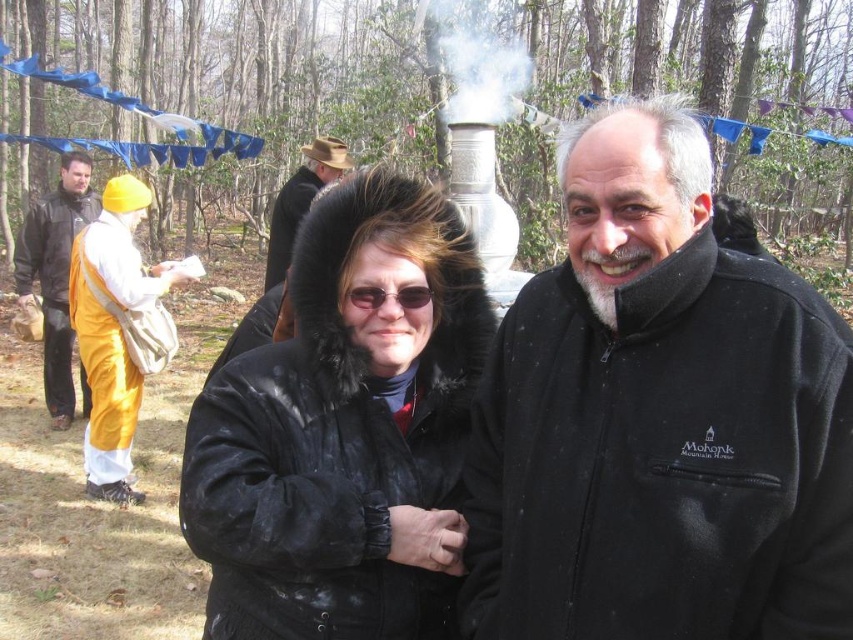
Question: Which of the following is the farthest from the observer?

Choices:
 (A) sunglasses at center
 (B) black fleece jacket at center
 (C) matte yellow robe at left

Answer: (C)

Question: Can you confirm if black fleece jacket at center is positioned above brown felt hat at upper center?

Choices:
 (A) yes
 (B) no

Answer: (B)

Question: Is black fleece jacket at center closer to the viewer compared to matte yellow robe at left?

Choices:
 (A) no
 (B) yes

Answer: (B)

Question: Which point appears farthest from the camera in this image?

Choices:
 (A) click(x=90, y=342)
 (B) click(x=286, y=236)
 (C) click(x=619, y=381)

Answer: (B)

Question: Which object is positioned closest to the brown felt hat at upper center?

Choices:
 (A) black leather jacket at center
 (B) orange fabric turban at left
 (C) matte yellow robe at left
 (D) black fleece jacket at center

Answer: (B)

Question: Considering the relative positions of black fleece jacket at center and matte yellow robe at left in the image provided, where is black fleece jacket at center located with respect to matte yellow robe at left?

Choices:
 (A) above
 (B) below

Answer: (B)